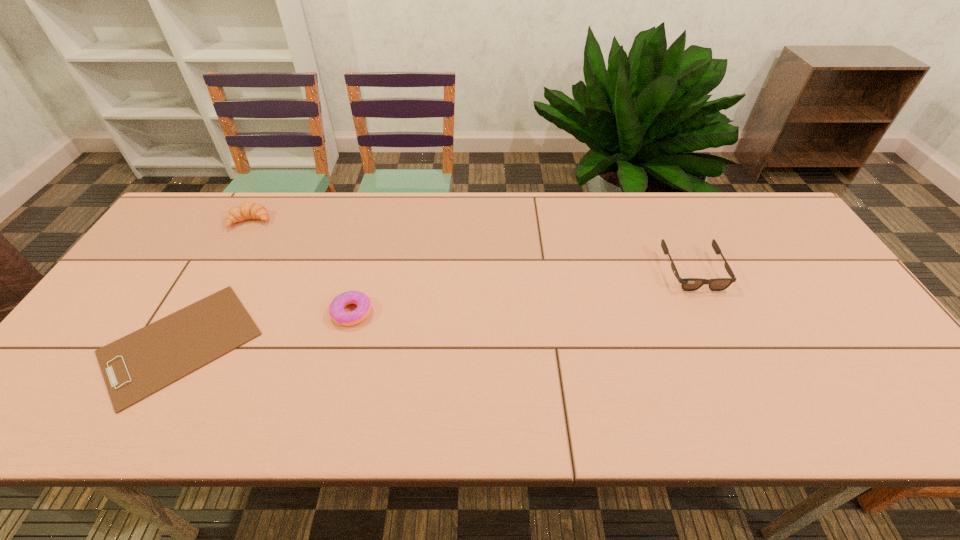
I want to click on object that stands as the third closest to the doughnut, so click(x=688, y=284).

The image size is (960, 540). Find the location of `vacant region that satisfies the following two spatial constraints: 1. on the back side of the clipboard; 2. on the left side of the crescent roll`. vacant region that satisfies the following two spatial constraints: 1. on the back side of the clipboard; 2. on the left side of the crescent roll is located at coordinates (251, 221).

Locate an element on the screen. The width and height of the screenshot is (960, 540). blank area in the image that satisfies the following two spatial constraints: 1. on the back side of the farthest object; 2. on the right side of the shortest object is located at coordinates pyautogui.click(x=251, y=221).